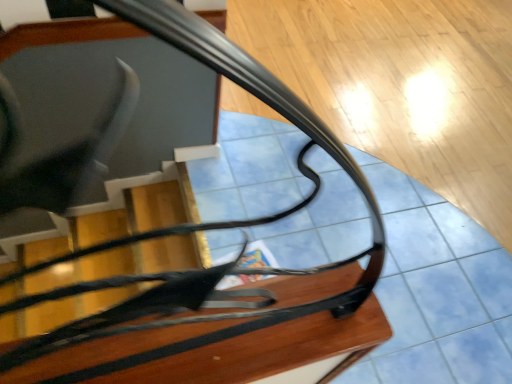
What do you see at coordinates (227, 339) in the screenshot? I see `glossy black glass table at center` at bounding box center [227, 339].

You are a GUI agent. You are given a task and a screenshot of the screen. Output one action in this format:
    pyautogui.click(x=<x>, y=<y>)
    Task: Click on the glossy black glass table at center
    The width and height of the screenshot is (512, 384).
    Given the screenshot: What is the action you would take?
    pyautogui.click(x=227, y=339)

Measure the distance between glossy black glass table at center and camera.

The depth of glossy black glass table at center is 17.89 inches.

Find the location of a particular element. The height and width of the screenshot is (384, 512). wooden table at center is located at coordinates (274, 352).

Describe the element at coordinates (274, 352) in the screenshot. I see `wooden table at center` at that location.

Where is `glossy black glass table at center`? Image resolution: width=512 pixels, height=384 pixels. glossy black glass table at center is located at coordinates (227, 339).

Considering the positions of objects glossy black glass table at center and wooden table at center in the image provided, who is more to the right, glossy black glass table at center or wooden table at center?

Positioned to the right is glossy black glass table at center.

Relative to wooden table at center, is glossy black glass table at center in front or behind?

Clearly, glossy black glass table at center is behind wooden table at center.

Is point (234, 299) closer to camera compared to point (360, 311)?

That is False.

From the image's perspective, is glossy black glass table at center over wooden table at center?

Yes.

From a real-world perspective, is glossy black glass table at center on wooden table at center?

No, from a real-world perspective, glossy black glass table at center is not on top of wooden table at center.

Based on the photo, between glossy black glass table at center and wooden table at center, which one has larger width?

glossy black glass table at center.

Is glossy black glass table at center taller than wooden table at center?

Correct, glossy black glass table at center is much taller as wooden table at center.

Is glossy black glass table at center bigger or smaller than wooden table at center?

In the image, glossy black glass table at center appears to be larger than wooden table at center.

Is wooden table at center a part of glossy black glass table at center?

That's incorrect, wooden table at center is not inside glossy black glass table at center.

Would you consider glossy black glass table at center to be distant from wooden table at center?

That's not correct — glossy black glass table at center is a little close to wooden table at center.

Does glossy black glass table at center turn towards wooden table at center?

No, glossy black glass table at center is not aimed at wooden table at center.

Find the location of a particular element. The height and width of the screenshot is (384, 512). furniture above the wooden table at center (from the image's perspective) is located at coordinates point(227,339).

Would you say wooden table at center is to the left or to the right of glossy black glass table at center in the picture?

Clearly, wooden table at center is on the left of glossy black glass table at center in the image.

Is wooden table at center further to camera compared to glossy black glass table at center?

That is False.

Is point (388, 331) closer to camera compared to point (113, 250)?

That is True.

From the image's perspective, is wooden table at center above or below glossy black glass table at center?

wooden table at center is below glossy black glass table at center.

From a real-world perspective, who is located lower, wooden table at center or glossy black glass table at center?

glossy black glass table at center is physically lower.

Is wooden table at center wider than glossy black glass table at center?

In fact, wooden table at center might be narrower than glossy black glass table at center.

Is wooden table at center taller or shorter than glossy black glass table at center?

In the image, wooden table at center appears to be shorter than glossy black glass table at center.

Which of these two, wooden table at center or glossy black glass table at center, is smaller?

With smaller size is wooden table at center.

Is wooden table at center inside the boundaries of glossy black glass table at center, or outside?

wooden table at center is outside glossy black glass table at center.

Would you say wooden table at center is a long distance from glossy black glass table at center?

They are positioned close to each other.

Is wooden table at center facing towards glossy black glass table at center?

No, wooden table at center does not turn towards glossy black glass table at center.

How distant is wooden table at center from glossy black glass table at center?

The distance of wooden table at center from glossy black glass table at center is 2.97 inches.

Find the location of a particular element. This screenshot has height=384, width=512. table to the left of glossy black glass table at center is located at coordinates (274, 352).

Find the location of a particular element. This screenshot has height=384, width=512. table above the glossy black glass table at center (from a real-world perspective) is located at coordinates (274, 352).

In the image, there is a wooden table at center. Where is `furniture below it (from a real-world perspective)`? Image resolution: width=512 pixels, height=384 pixels. furniture below it (from a real-world perspective) is located at coordinates (227, 339).